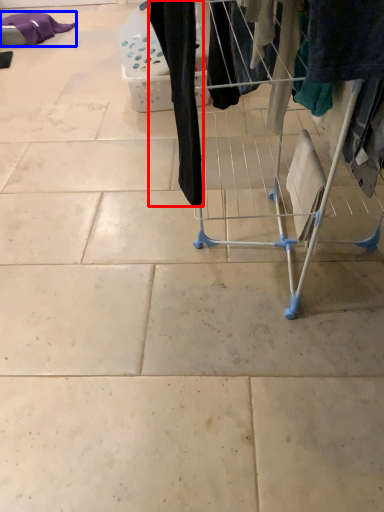
Question: Among these objects, which one is nearest to the camera, clothing (highlighted by a red box) or clothing (highlighted by a blue box)?

Choices:
 (A) clothing
 (B) clothing

Answer: (A)